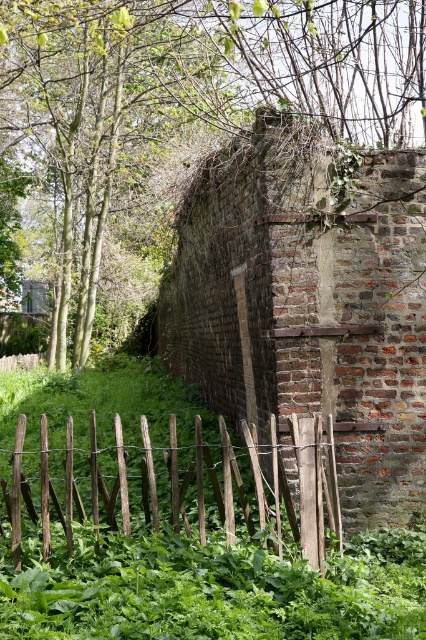
Which is more to the left, green leafy grass at lower center or wooden fence at lower left?

Positioned to the left is wooden fence at lower left.

Is green leafy grass at lower center shorter than wooden fence at lower left?

Indeed, green leafy grass at lower center has a lesser height compared to wooden fence at lower left.

This screenshot has height=640, width=426. Describe the element at coordinates (213, 589) in the screenshot. I see `green leafy grass at lower center` at that location.

Locate an element on the screen. This screenshot has height=640, width=426. green leafy grass at lower center is located at coordinates (213, 589).

Does green leafy tree at upper left lie in front of green leafy grass at lower center?

No, green leafy tree at upper left is behind green leafy grass at lower center.

Is green leafy tree at upper left positioned at the back of green leafy grass at lower center?

Yes, green leafy tree at upper left is behind green leafy grass at lower center.

Between point (92, 99) and point (258, 570), which one is positioned in front?

Point (258, 570) is more forward.

Locate an element on the screen. The height and width of the screenshot is (640, 426). green leafy tree at upper left is located at coordinates (189, 93).

This screenshot has height=640, width=426. I want to click on brick wall at center, so click(x=308, y=305).

Is point (391, 486) behind point (365, 554)?

Yes, point (391, 486) is behind point (365, 554).

Which is in front, point (250, 317) or point (212, 545)?

Point (212, 545)

The height and width of the screenshot is (640, 426). In order to click on brick wall at center in this screenshot , I will do `click(308, 305)`.